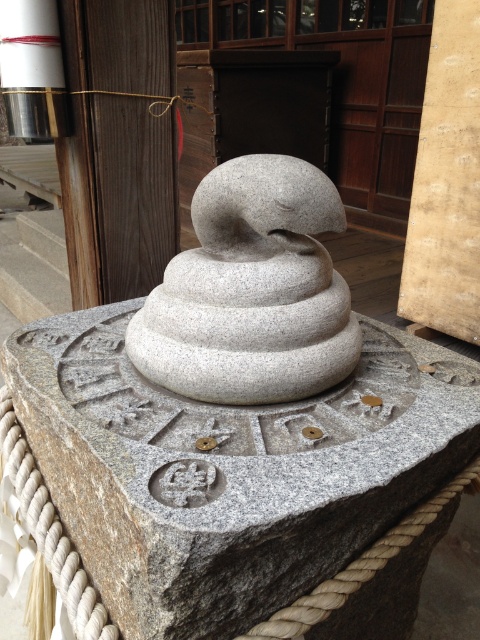
From the picture: You are an art student observing the stone sculpture and its pedestal. You notice two objects on the pedestal. The first is the gray stone snake at center, and the second is the gray stone sculpture at center. Which of these two objects is positioned more to the left?

The gray stone snake at center is positioned more to the left than the gray stone sculpture at center.

You are an art student observing the stone sculpture and its pedestal. You notice both the gray stone snake at center and the gray stone sculpture at center. Which one is closer to you?

The gray stone snake at center is in front of the gray stone sculpture at center, so it is closer to you.

Please provide the coordinates of the gray stone sculpture at center.

The gray stone sculpture at center is located at coordinates point (252, 291).